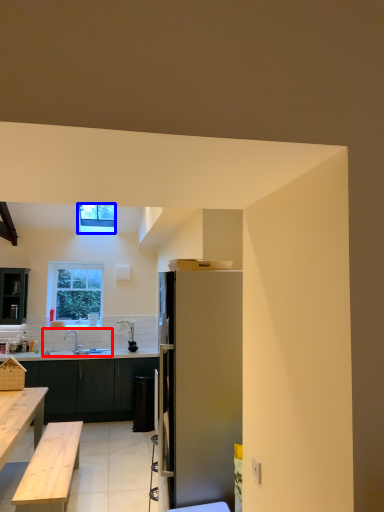
Question: Which object appears farthest to the camera in this image, sink (highlighted by a red box) or window (highlighted by a blue box)?

Choices:
 (A) sink
 (B) window

Answer: (A)